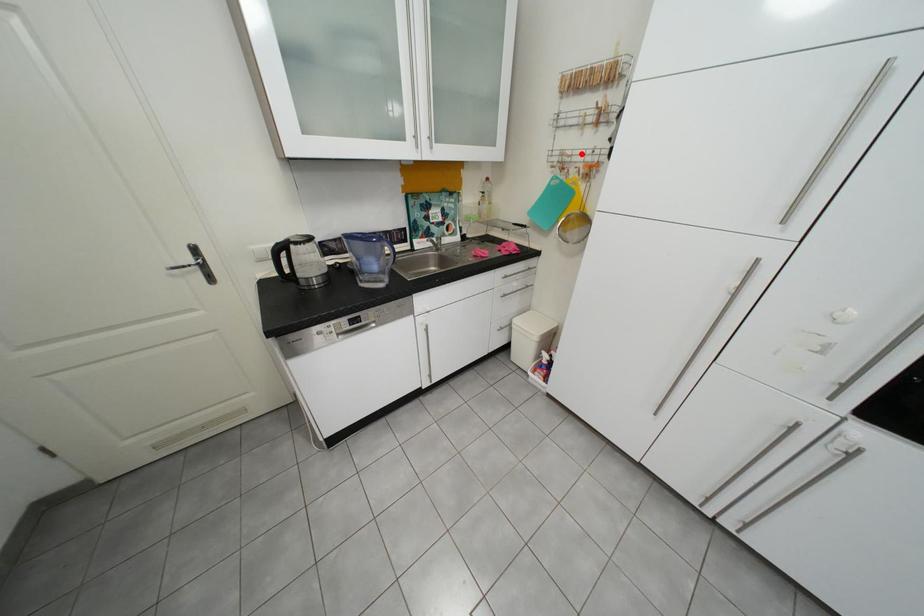
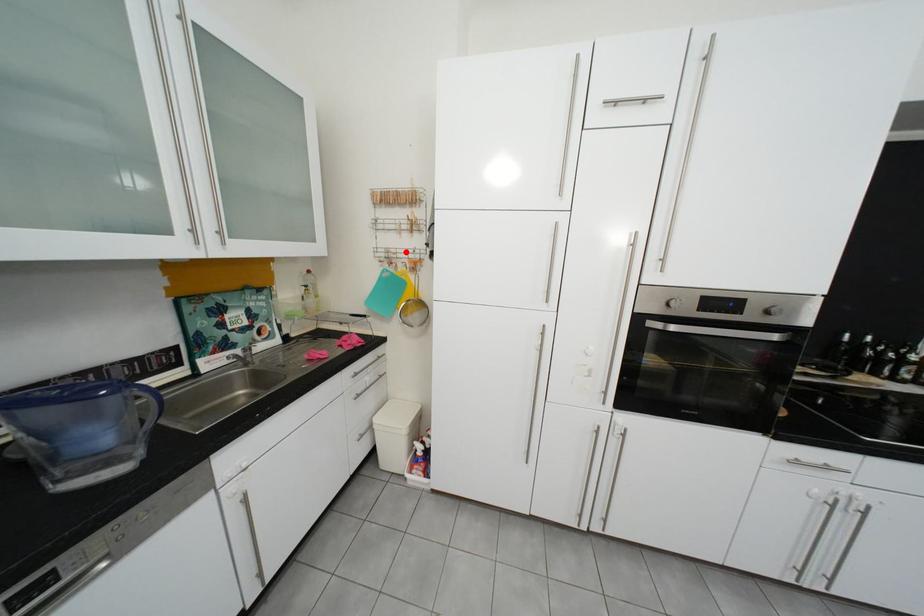
In the scene shown: I am providing you with two images of the same scene from different viewpoints. A red point is marked on the first image and another point is marked on the second image. Is the marked point in image1 the same physical position as the marked point in image2?

Yes